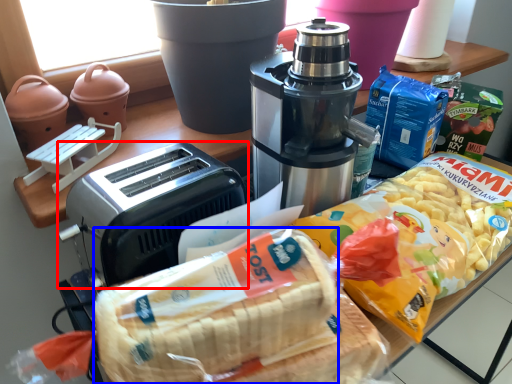
Question: Which object is closer to the camera taking this photo, toaster (highlighted by a red box) or treat (highlighted by a blue box)?

Choices:
 (A) toaster
 (B) treat

Answer: (B)